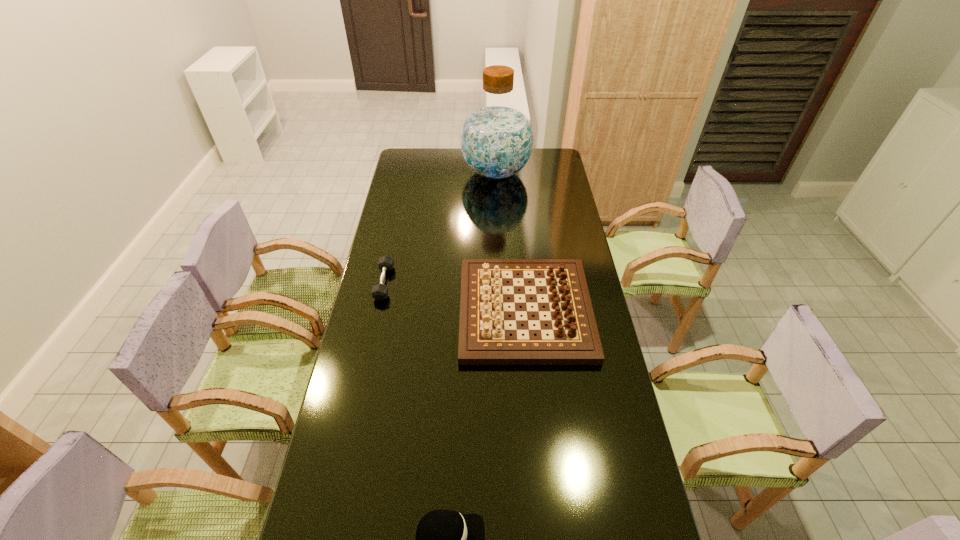
Identify the location of the tallest object. (496, 139).

You are a GUI agent. You are given a task and a screenshot of the screen. Output one action in this format:
    pyautogui.click(x=<x>, y=<y>)
    Task: Click on the farthest object
    This screenshot has width=960, height=540.
    Given the screenshot: What is the action you would take?
    pyautogui.click(x=496, y=139)

The width and height of the screenshot is (960, 540). In order to click on the third shortest object in this screenshot , I will do `click(484, 333)`.

Identify the location of the shortest object. (379, 292).

Locate an element on the screen. The width and height of the screenshot is (960, 540). dumbbell is located at coordinates (379, 292).

Where is `vacant point located on the left of the tallest object`? Image resolution: width=960 pixels, height=540 pixels. vacant point located on the left of the tallest object is located at coordinates [442, 173].

Find the location of a particular element. The width and height of the screenshot is (960, 540). blank space located on the side with the white pieces of the third shortest object is located at coordinates (420, 310).

Locate an element on the screen. Image resolution: width=960 pixels, height=540 pixels. free space located on the side with the white pieces of the third shortest object is located at coordinates (411, 310).

You are a GUI agent. You are given a task and a screenshot of the screen. Output one action in this format:
    pyautogui.click(x=<x>, y=<y>)
    Task: Click on the vacant space positioned 0.320m on the side with the white pieces of the third shortest object
    The image size is (960, 540).
    Given the screenshot: What is the action you would take?
    pyautogui.click(x=373, y=310)

Locate an element on the screen. Image resolution: width=960 pixels, height=540 pixels. free space located on the right of the leftmost object is located at coordinates (473, 282).